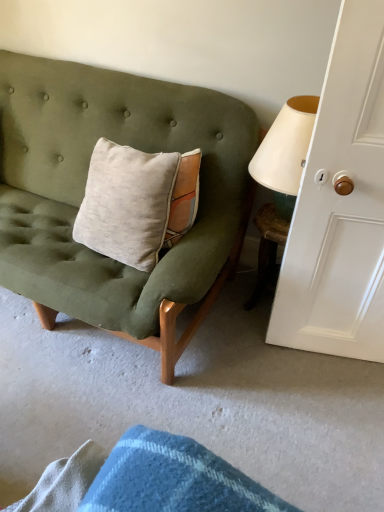
Question: Is wooden table at lower right bigger than white painted wood door at right?

Choices:
 (A) no
 (B) yes

Answer: (A)

Question: From the image's perspective, is wooden table at lower right under white painted wood door at right?

Choices:
 (A) no
 (B) yes

Answer: (B)

Question: Can you confirm if wooden table at lower right is taller than white painted wood door at right?

Choices:
 (A) no
 (B) yes

Answer: (A)

Question: Considering the relative positions of wooden table at lower right and white painted wood door at right in the image provided, is wooden table at lower right in front of white painted wood door at right?

Choices:
 (A) no
 (B) yes

Answer: (A)

Question: Does wooden table at lower right have a lesser width compared to white painted wood door at right?

Choices:
 (A) no
 (B) yes

Answer: (A)

Question: Considering the relative sizes of wooden table at lower right and white painted wood door at right in the image provided, is wooden table at lower right smaller than white painted wood door at right?

Choices:
 (A) no
 (B) yes

Answer: (B)

Question: Is matte green fabric couch at left looking in the opposite direction of white painted wood door at right?

Choices:
 (A) yes
 (B) no

Answer: (B)

Question: Is matte green fabric couch at left closer to camera compared to white painted wood door at right?

Choices:
 (A) yes
 (B) no

Answer: (B)

Question: From a real-world perspective, is matte green fabric couch at left physically above white painted wood door at right?

Choices:
 (A) no
 (B) yes

Answer: (A)

Question: Does matte green fabric couch at left have a lesser height compared to white painted wood door at right?

Choices:
 (A) yes
 (B) no

Answer: (A)

Question: Could you tell me if matte green fabric couch at left is turned towards white painted wood door at right?

Choices:
 (A) no
 (B) yes

Answer: (A)

Question: From the image's perspective, does matte green fabric couch at left appear lower than white painted wood door at right?

Choices:
 (A) yes
 (B) no

Answer: (B)

Question: Is wooden table at lower right looking in the opposite direction of matte green fabric couch at left?

Choices:
 (A) yes
 (B) no

Answer: (B)